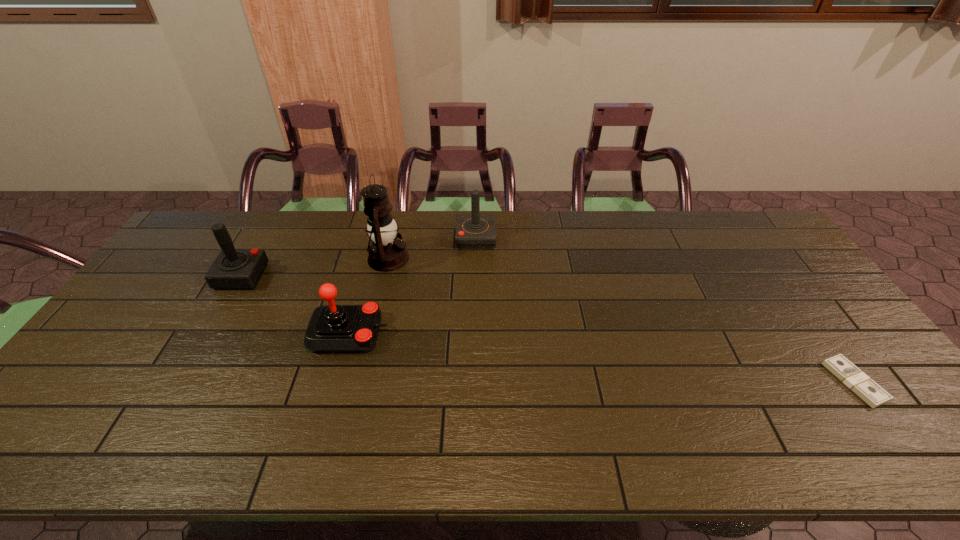
Where is `vacant position at the far right corner of the desktop`? This screenshot has width=960, height=540. vacant position at the far right corner of the desktop is located at coordinates (740, 242).

Locate an element on the screen. free point between the tallest object and the dollar is located at coordinates (621, 320).

You are a GUI agent. You are given a task and a screenshot of the screen. Output one action in this format:
    pyautogui.click(x=<x>, y=<y>)
    Task: Click on the empty space that is in between the shortest object and the second nearest object
    The width and height of the screenshot is (960, 540).
    Given the screenshot: What is the action you would take?
    pyautogui.click(x=602, y=357)

You are a GUI agent. You are given a task and a screenshot of the screen. Output one action in this format:
    pyautogui.click(x=<x>, y=<y>)
    Task: Click on the free space between the tallest object and the second farthest joystick
    
    Given the screenshot: What is the action you would take?
    pyautogui.click(x=315, y=267)

Locate an element on the screen. empty location between the nearest joystick and the farthest joystick is located at coordinates (413, 285).

I want to click on empty space that is in between the tallest object and the shortest object, so click(x=621, y=320).

Locate an element on the screen. Image resolution: width=960 pixels, height=540 pixels. vacant area between the farthest joystick and the rightmost object is located at coordinates (665, 309).

Identify the location of free spot between the tallest object and the dollar. The height and width of the screenshot is (540, 960). (621, 320).

The height and width of the screenshot is (540, 960). What are the coordinates of `free space between the leftmost object and the nearest object` in the screenshot? It's located at (548, 329).

At what (x,y) coordinates should I click in order to perform the action: click on unoccupied position between the leftmost object and the farthest joystick. Please return your answer as a coordinate pair (x, y). The height and width of the screenshot is (540, 960). Looking at the image, I should click on (359, 257).